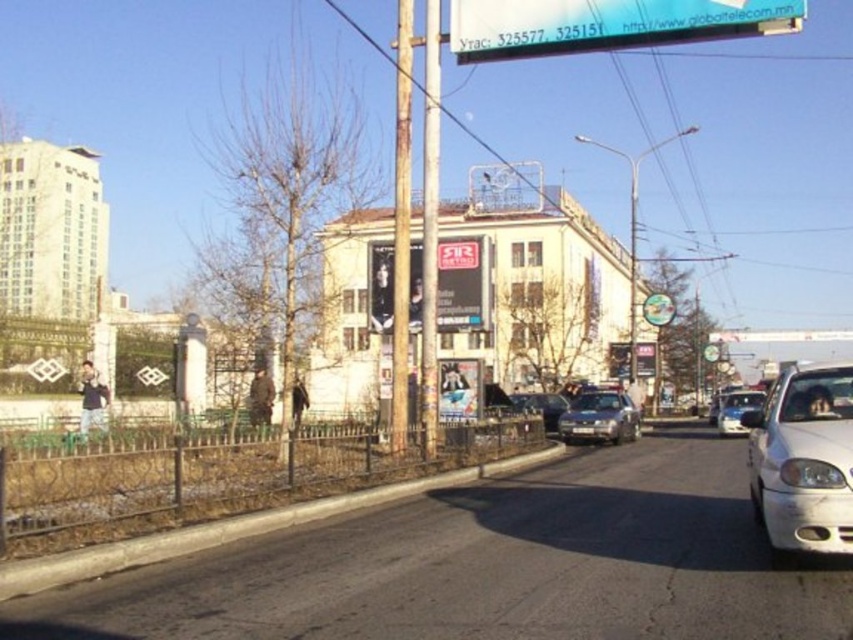
Is rusty wood pole at center closer to the viewer compared to white glossy sedan at center-right?

Yes.

The image size is (853, 640). What do you see at coordinates (401, 224) in the screenshot? I see `rusty wood pole at center` at bounding box center [401, 224].

The width and height of the screenshot is (853, 640). I want to click on rusty wood pole at center, so click(x=401, y=224).

Describe the element at coordinates (804, 460) in the screenshot. I see `white matte car at lower right` at that location.

Can you confirm if white matte car at lower right is positioned to the left of silver metallic sedan at center?

Indeed, white matte car at lower right is positioned on the left side of silver metallic sedan at center.

Identify the location of white matte car at lower right. (804, 460).

Is rusty wood pole at center further to the viewer compared to silver metallic sedan at center?

No, rusty wood pole at center is in front of silver metallic sedan at center.

Is rusty wood pole at center above silver metallic sedan at center?

Yes, rusty wood pole at center is above silver metallic sedan at center.

At what (x,y) coordinates should I click in order to perform the action: click on rusty wood pole at center. Please return your answer as a coordinate pair (x, y). The height and width of the screenshot is (640, 853). Looking at the image, I should click on (401, 224).